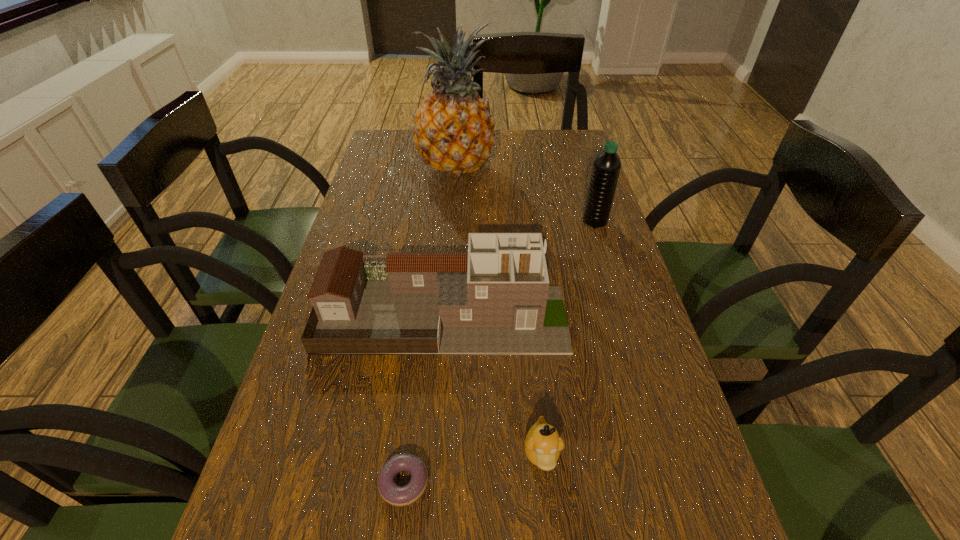
Locate an element on the screen. Image resolution: width=960 pixels, height=540 pixels. free space at the right edge is located at coordinates (687, 503).

The image size is (960, 540). In the image, there is a desktop. What are the coordinates of `vacant region at the far right corner` in the screenshot? It's located at (553, 154).

The width and height of the screenshot is (960, 540). Identify the location of free spot between the shortest object and the duckling. (473, 468).

Identify the location of vacant region between the shortest object and the second shortest object. (473, 468).

Where is `free space between the doughnut and the dollhouse`? The height and width of the screenshot is (540, 960). free space between the doughnut and the dollhouse is located at coordinates (423, 397).

The width and height of the screenshot is (960, 540). What are the coordinates of `unoccupied position between the shortest object and the dollhouse` in the screenshot? It's located at (423, 397).

Locate an element on the screen. object that is the third closest to the dollhouse is located at coordinates (395, 495).

Where is `the fourth closest object to the duckling`? The height and width of the screenshot is (540, 960). the fourth closest object to the duckling is located at coordinates (453, 130).

Locate an element on the screen. This screenshot has width=960, height=540. vacant region that satisfies the following two spatial constraints: 1. on the front side of the farthest object; 2. at the main entrance of the third nearest object is located at coordinates (444, 313).